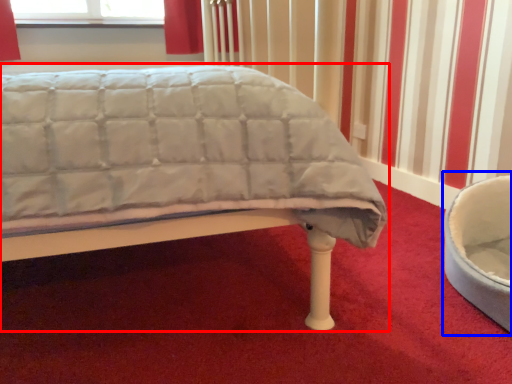
Question: Which of the following is the farthest to the observer, bed (highlighted by a red box) or bean bag chair (highlighted by a blue box)?

Choices:
 (A) bed
 (B) bean bag chair

Answer: (B)